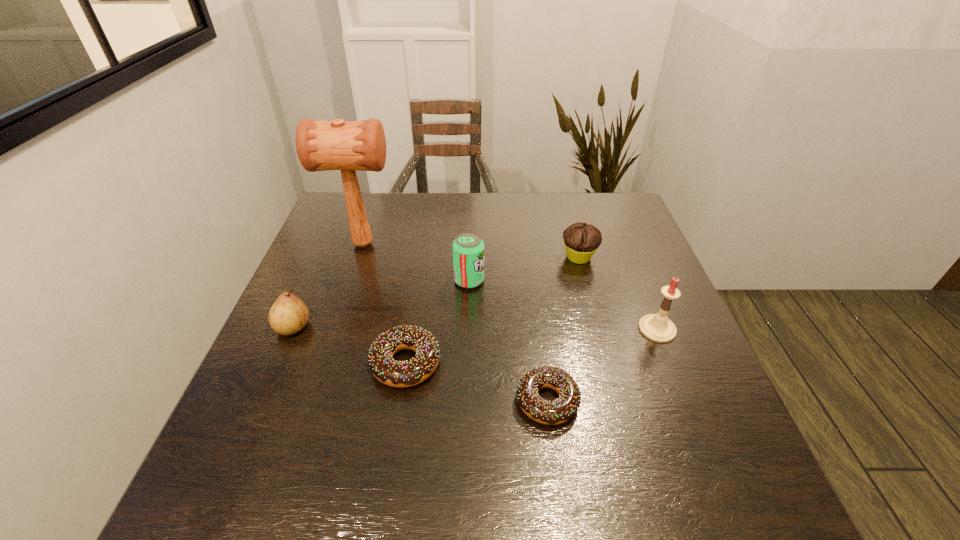
The width and height of the screenshot is (960, 540). I want to click on the left doughnut, so click(408, 373).

This screenshot has width=960, height=540. Find the location of `the second shortest object`. the second shortest object is located at coordinates (408, 373).

You are a GUI agent. You are given a task and a screenshot of the screen. Output one action in this format:
    pyautogui.click(x=<x>, y=<y>)
    Task: Click on the shorter doughnut
    The height and width of the screenshot is (540, 960).
    Given the screenshot: What is the action you would take?
    pyautogui.click(x=561, y=410)

Find the location of a particular element. The image size is (960, 540). the right doughnut is located at coordinates (561, 410).

You are a GUI agent. You are given a task and a screenshot of the screen. Output one action in this format:
    pyautogui.click(x=<x>, y=<y>)
    Task: Click on the mallet
    Image resolution: width=960 pixels, height=540 pixels.
    Given the screenshot: What is the action you would take?
    pyautogui.click(x=321, y=145)

I want to click on pop soda, so click(x=468, y=248).

Identify the location of the third farthest object. The height and width of the screenshot is (540, 960). [x=468, y=248].

What are the coordinates of `candle` in the screenshot? It's located at (657, 327).

At what (x,y) coordinates should I click in order to perform the action: click on the fifth tallest object. Please return your answer as a coordinate pair (x, y). Looking at the image, I should click on (581, 241).

Where is `muffin`? This screenshot has height=540, width=960. muffin is located at coordinates (581, 241).